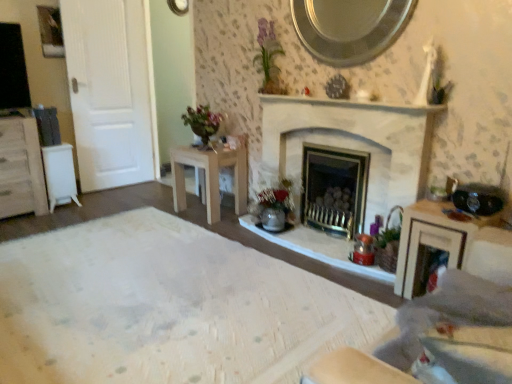
Question: Considering the relative sizes of wooden vanity at right and light wood table at center, the second table positioned from the left, in the image provided, is wooden vanity at right taller than light wood table at center, the second table positioned from the left,?

Choices:
 (A) yes
 (B) no

Answer: (B)

Question: Are wooden vanity at right and light wood table at center, the 1th table viewed from the right, located far from each other?

Choices:
 (A) no
 (B) yes

Answer: (B)

Question: Is wooden vanity at right looking in the opposite direction of light wood table at center, the second table positioned from the left?

Choices:
 (A) no
 (B) yes

Answer: (A)

Question: From a real-world perspective, is wooden vanity at right on light wood table at center, the second table positioned from the left?

Choices:
 (A) no
 (B) yes

Answer: (A)

Question: Is wooden vanity at right smaller than light wood table at center, the 1th table viewed from the right?

Choices:
 (A) no
 (B) yes

Answer: (B)

Question: Is light wood table at center, the 1th table viewed from the right, in front of or behind white wood cabinet at left in the image?

Choices:
 (A) front
 (B) behind

Answer: (B)

Question: Is light wood table at center, the second table positioned from the left, situated inside white wood cabinet at left or outside?

Choices:
 (A) outside
 (B) inside

Answer: (A)

Question: From a real-world perspective, is light wood table at center, the second table positioned from the left, above or below white wood cabinet at left?

Choices:
 (A) below
 (B) above

Answer: (A)

Question: From the image's perspective, is light wood table at center, the second table positioned from the left, positioned above or below white wood cabinet at left?

Choices:
 (A) below
 (B) above

Answer: (A)

Question: From their relative heights in the image, would you say white matte door at left is taller or shorter than light wood table at center, the 1th table viewed from the right?

Choices:
 (A) short
 (B) tall

Answer: (B)

Question: Considering the positions of point (145, 72) and point (181, 153), is point (145, 72) closer or farther from the camera than point (181, 153)?

Choices:
 (A) farther
 (B) closer

Answer: (A)

Question: In terms of width, does white matte door at left look wider or thinner when compared to light wood table at center, the 1th table viewed from the right?

Choices:
 (A) thin
 (B) wide

Answer: (A)

Question: Based on their sizes in the image, would you say white matte door at left is bigger or smaller than light wood table at center, the second table positioned from the left?

Choices:
 (A) big
 (B) small

Answer: (A)

Question: Considering the positions of white matte door at left and white plastic table at left, the second table viewed from the right, in the image, is white matte door at left taller or shorter than white plastic table at left, the second table viewed from the right,?

Choices:
 (A) short
 (B) tall

Answer: (B)

Question: From the image's perspective, relative to white plastic table at left, which is the first table in left-to-right order, is white matte door at left above or below?

Choices:
 (A) above
 (B) below

Answer: (A)